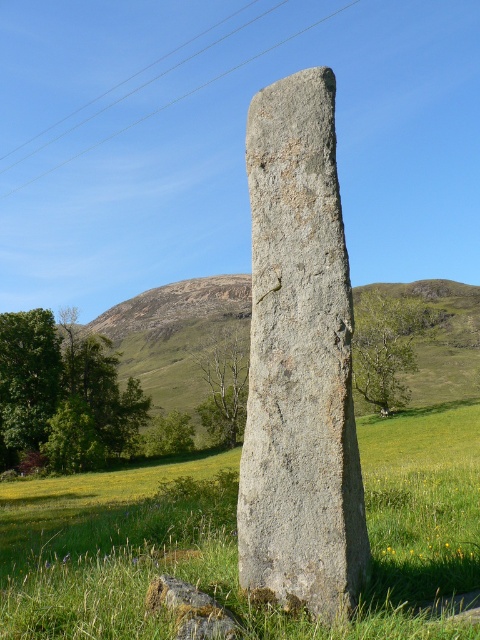
Question: Does green grassy at center appear under gray rough stone at center?

Choices:
 (A) no
 (B) yes

Answer: (B)

Question: Which point is closer to the camera?

Choices:
 (A) green grassy hillside at center
 (B) gray rough stone at center

Answer: (B)

Question: Is green grassy at center wider than clear blue sky at upper center?

Choices:
 (A) no
 (B) yes

Answer: (A)

Question: Does green grassy at center appear under clear blue sky at upper center?

Choices:
 (A) yes
 (B) no

Answer: (A)

Question: Estimate the real-world distances between objects in this image. Which object is farther from the gray rough stone at center?

Choices:
 (A) green grassy at center
 (B) green grassy hillside at center

Answer: (B)

Question: Estimate the real-world distances between objects in this image. Which object is closer to the clear blue sky at upper center?

Choices:
 (A) green grassy at center
 (B) green grassy hillside at center
 (C) gray rough stone at center

Answer: (B)